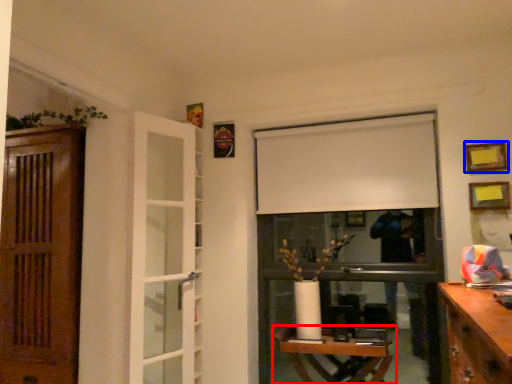
Question: Which object appears farthest to the camera in this image, table (highlighted by a red box) or picture frame (highlighted by a blue box)?

Choices:
 (A) table
 (B) picture frame

Answer: (B)